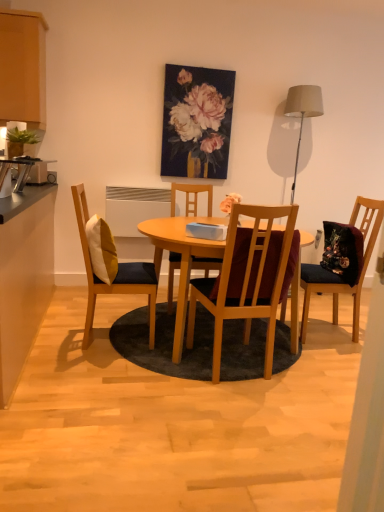
Find the location of `free location above oil paint canvas at upper center (from a real-world perspective)`. free location above oil paint canvas at upper center (from a real-world perspective) is located at coordinates (210, 62).